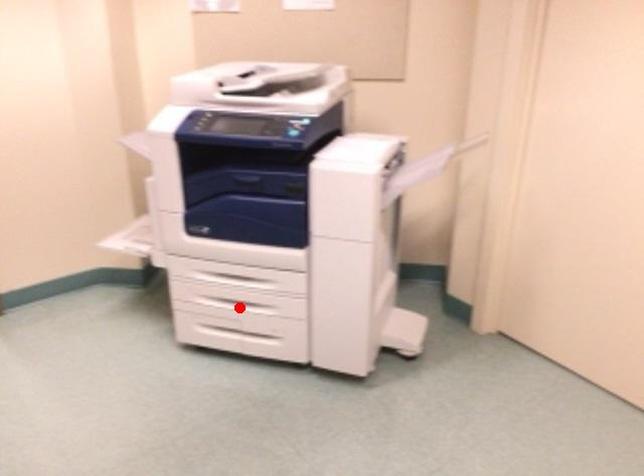
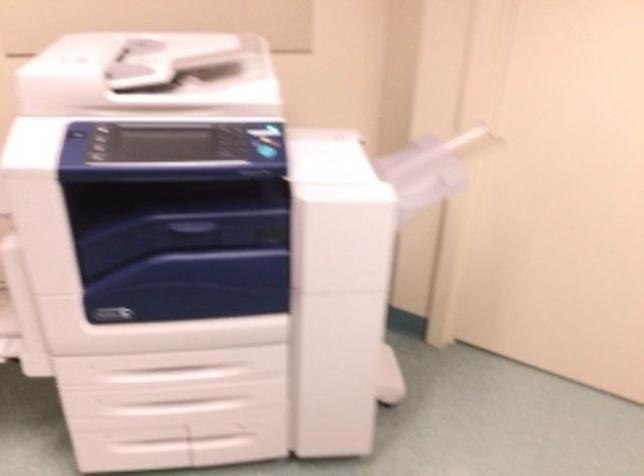
In the second image, find the point that corresponds to the highlighted location in the first image.

(180, 406)